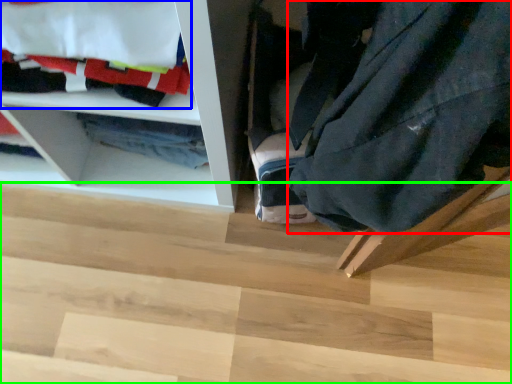
Question: Which is farther away from clothing (highlighted by a red box)? laundry (highlighted by a blue box) or stair (highlighted by a green box)?

Choices:
 (A) laundry
 (B) stair

Answer: (B)